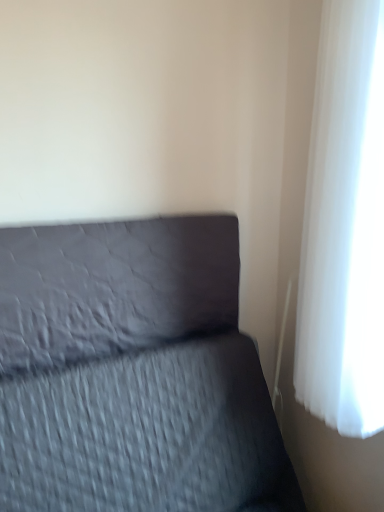
Question: From the image's perspective, is matte gray pillow at center located above white sheer curtain at right?

Choices:
 (A) yes
 (B) no

Answer: (B)

Question: Is white sheer curtain at right inside matte gray pillow at center?

Choices:
 (A) yes
 (B) no

Answer: (B)

Question: Considering the relative positions of matte gray pillow at center and white sheer curtain at right in the image provided, is matte gray pillow at center to the right of white sheer curtain at right from the viewer's perspective?

Choices:
 (A) no
 (B) yes

Answer: (A)

Question: Is matte gray pillow at center positioned beyond the bounds of white sheer curtain at right?

Choices:
 (A) yes
 (B) no

Answer: (A)

Question: Can you confirm if matte gray pillow at center is positioned to the left of white sheer curtain at right?

Choices:
 (A) no
 (B) yes

Answer: (B)

Question: From the image's perspective, is white sheer curtain at right above or below matte gray pillow at center?

Choices:
 (A) below
 (B) above

Answer: (B)

Question: Considering the positions of white sheer curtain at right and matte gray pillow at center in the image, is white sheer curtain at right taller or shorter than matte gray pillow at center?

Choices:
 (A) short
 (B) tall

Answer: (B)

Question: Is white sheer curtain at right to the left or to the right of matte gray pillow at center in the image?

Choices:
 (A) right
 (B) left

Answer: (A)

Question: From a real-world perspective, relative to matte gray pillow at center, is white sheer curtain at right vertically above or below?

Choices:
 (A) below
 (B) above

Answer: (B)

Question: Considering the positions of point (380, 81) and point (56, 456), is point (380, 81) closer or farther from the camera than point (56, 456)?

Choices:
 (A) closer
 (B) farther

Answer: (A)

Question: In the image, is white sheer curtain at right on the left side or the right side of textured gray bed at lower left?

Choices:
 (A) left
 (B) right

Answer: (B)

Question: Looking at the image, does white sheer curtain at right seem bigger or smaller compared to textured gray bed at lower left?

Choices:
 (A) big
 (B) small

Answer: (B)

Question: In terms of height, does white sheer curtain at right look taller or shorter compared to textured gray bed at lower left?

Choices:
 (A) tall
 (B) short

Answer: (A)

Question: Is point (107, 318) closer or farther from the camera than point (231, 498)?

Choices:
 (A) closer
 (B) farther

Answer: (A)

Question: Visually, is matte gray pillow at center positioned to the left or to the right of textured gray bed at lower left?

Choices:
 (A) right
 (B) left

Answer: (B)